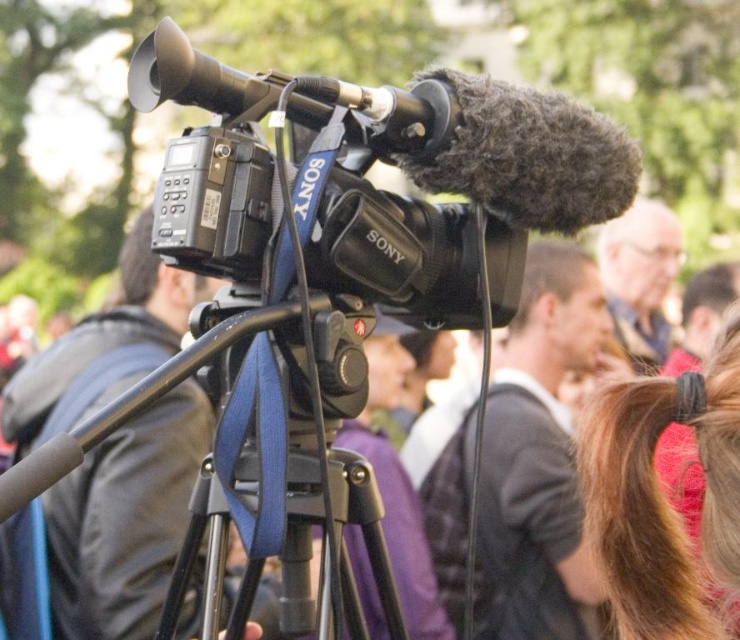
Question: Based on their relative distances, which object is farther from the black matte camera at center?

Choices:
 (A) blue fabric tripod at center
 (B) dark gray sweater at center

Answer: (A)

Question: Which object is positioned closest to the blue fabric tripod at center?

Choices:
 (A) black matte camera at center
 (B) dark gray sweater at center

Answer: (A)

Question: Does black matte camera at center have a larger size compared to dark gray sweater at center?

Choices:
 (A) yes
 (B) no

Answer: (A)

Question: Does black matte camera at center come in front of blue fabric tripod at center?

Choices:
 (A) yes
 (B) no

Answer: (B)

Question: Which is farther from the dark gray sweater at center?

Choices:
 (A) black matte camera at center
 (B) blue fabric tripod at center

Answer: (B)

Question: Is black matte camera at center above dark gray sweater at center?

Choices:
 (A) yes
 (B) no

Answer: (A)